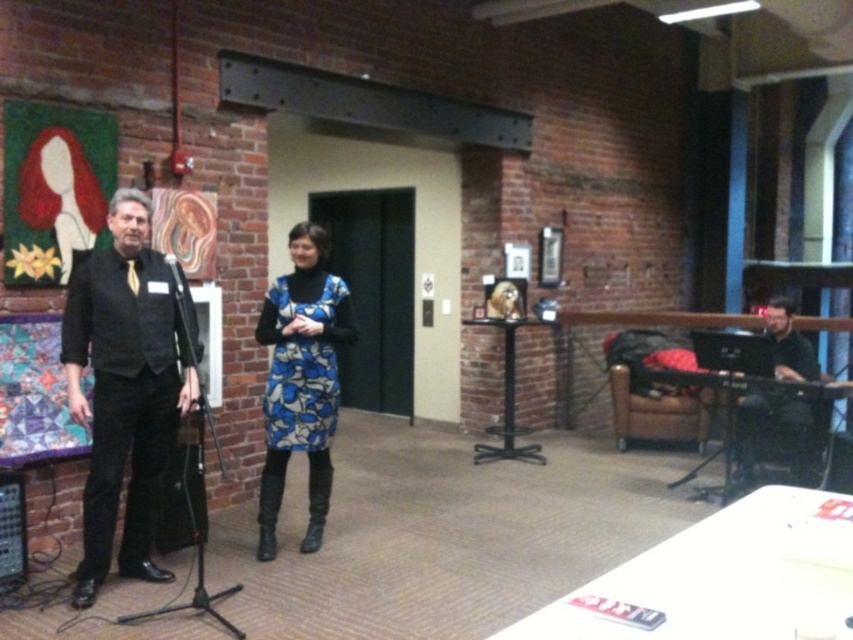
You are an event planner organizing a photo shoot in this gallery. You need to place a large tripod between the blue printed dress at center and the black matte laptop at right. Since the dress is larger, will the tripod fit comfortably between them?

The blue printed dress at center is larger in size than the black matte laptop at right. Therefore, there is sufficient space between them to comfortably place the large tripod.

You are setting up for an event and need to place a black matte laptop at right and a black matte microphone at left on a shelf. The shelf has limited height space. Which object requires more vertical space?

The black matte laptop at right requires more vertical space because it is taller than the black matte microphone at left.